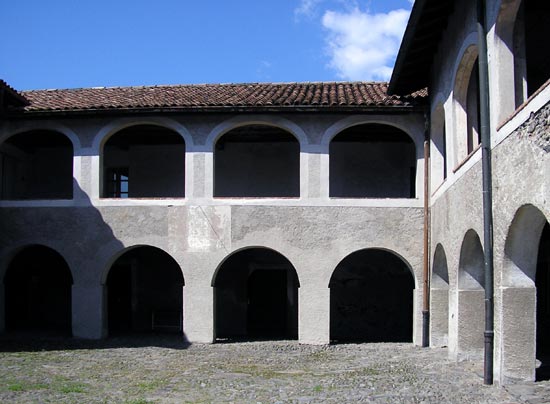
I want to click on white archway, so click(x=190, y=153), click(x=312, y=144).